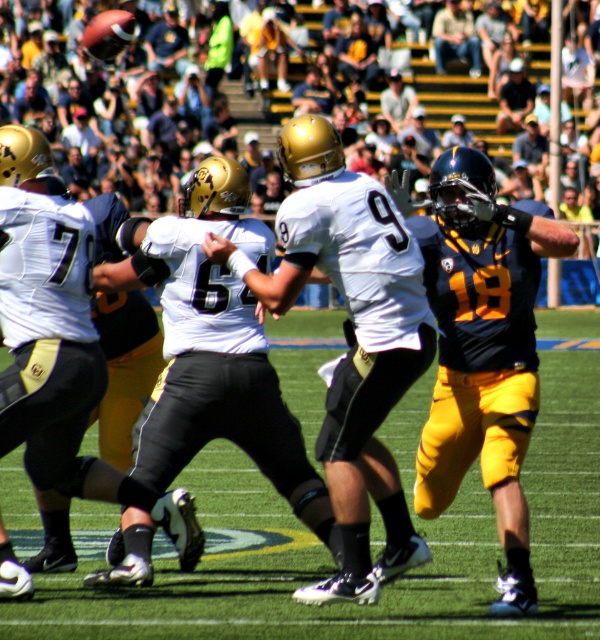
Does point (399, 262) come farther from viewer compared to point (96, 353)?

No.

Can you confirm if matte white jersey at center is positioned above white matte jersey at center?

No, matte white jersey at center is not above white matte jersey at center.

Which is in front, point (376, 218) or point (135, 490)?

Point (376, 218) is in front.

Locate an element on the screen. The height and width of the screenshot is (640, 600). matte white jersey at center is located at coordinates (355, 340).

Is white matte jersey at center to the right of dark blue jersey at center from the viewer's perspective?

Incorrect, white matte jersey at center is not on the right side of dark blue jersey at center.

Between white matte jersey at center and dark blue jersey at center, which one appears on the left side from the viewer's perspective?

Positioned to the left is white matte jersey at center.

Is point (57, 464) closer to viewer compared to point (454, 22)?

Yes, point (57, 464) is closer to viewer.

This screenshot has width=600, height=640. Identify the location of white matte jersey at center. (49, 330).

Does matte white jersey at center appear under dark blue jersey at center?

Indeed, matte white jersey at center is positioned under dark blue jersey at center.

Does matte white jersey at center have a smaller size compared to dark blue jersey at center?

Actually, matte white jersey at center might be larger than dark blue jersey at center.

The width and height of the screenshot is (600, 640). In order to click on matte white jersey at center in this screenshot , I will do `click(355, 340)`.